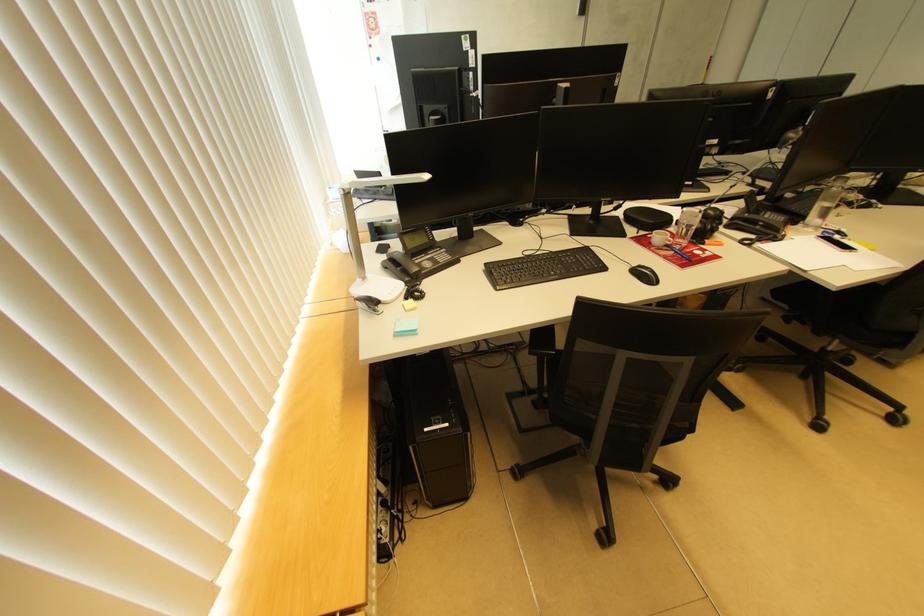
The image size is (924, 616). I want to click on chair armrest, so point(544,349).